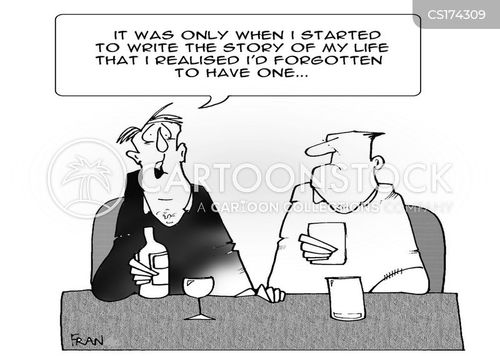
Locate an element on the screen. This screenshot has width=500, height=356. glass is located at coordinates (354, 301), (336, 227).